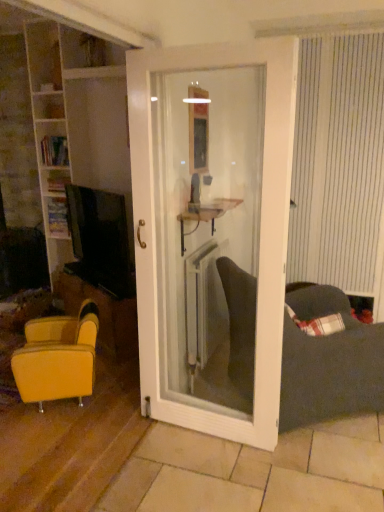
Image resolution: width=384 pixels, height=512 pixels. Identify the location of free space in front of dark gray fabric couch at lower right. (307, 467).